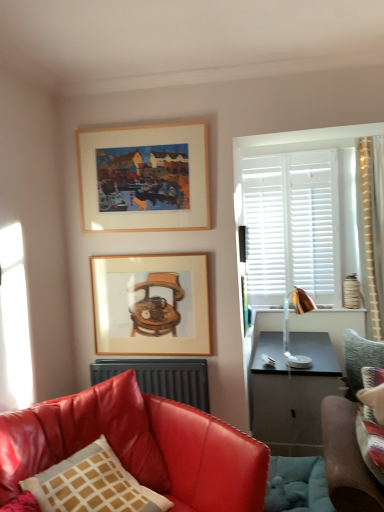
I want to click on vacant area on top of wooden frame at upper center, the 2th picture frame when ordered from bottom to top (from a real-world perspective), so click(147, 119).